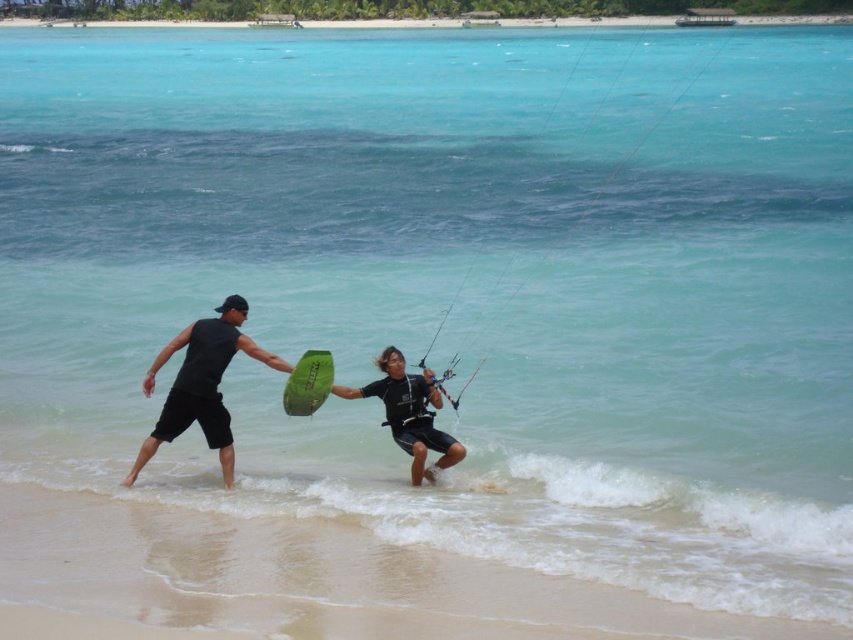
Is green matte surfboard at center shorter than matte black wetsuit at center?

Incorrect, green matte surfboard at center's height does not fall short of matte black wetsuit at center's.

Which is above, green matte surfboard at center or matte black wetsuit at center?

green matte surfboard at center is above.

I want to click on green matte surfboard at center, so click(x=202, y=385).

What do you see at coordinates (201, 385) in the screenshot?
I see `black matte shorts at center` at bounding box center [201, 385].

Can you confirm if black matte shorts at center is positioned below matte black wetsuit at center?

Incorrect, black matte shorts at center is not positioned below matte black wetsuit at center.

Describe the element at coordinates (201, 385) in the screenshot. I see `black matte shorts at center` at that location.

This screenshot has height=640, width=853. I want to click on black matte shorts at center, so click(201, 385).

Which is behind, point (283, 548) or point (397, 435)?

Positioned behind is point (397, 435).

Is sandy beach at lower center bigger than matte black wetsuit at center?

Correct, sandy beach at lower center is larger in size than matte black wetsuit at center.

Between point (57, 552) and point (405, 440), which one is positioned in front?

Point (57, 552) is more forward.

Locate an element on the screen. sandy beach at lower center is located at coordinates click(312, 577).